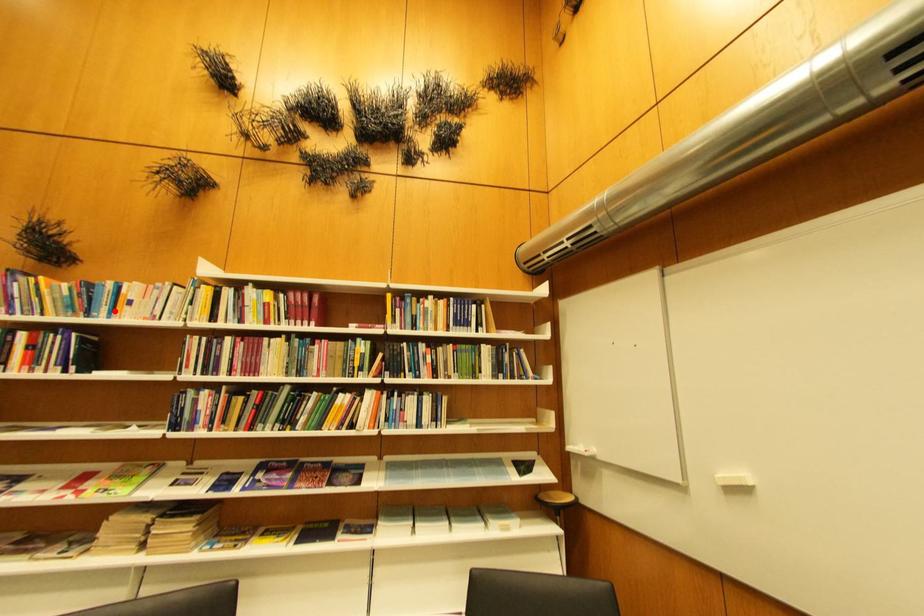
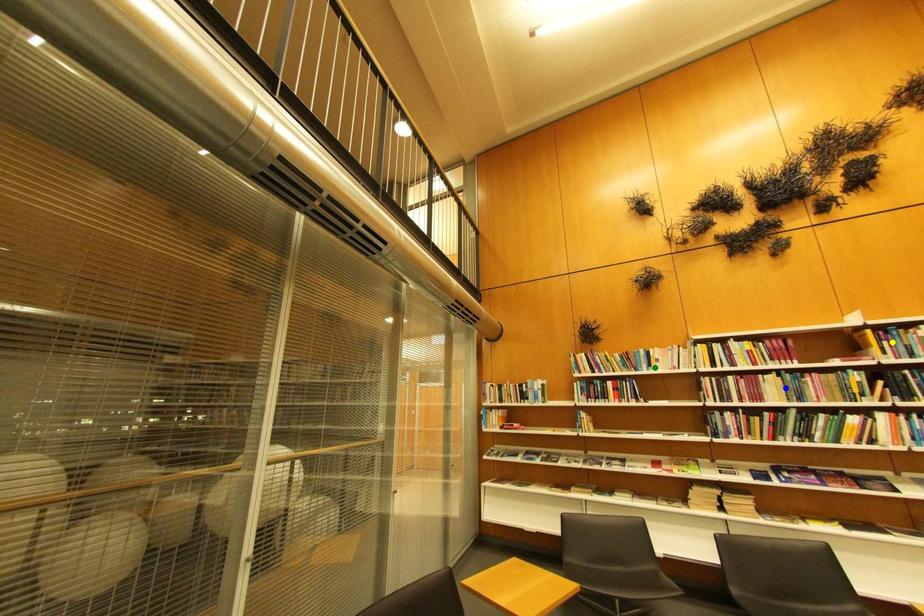
Question: I am providing you with two images of the same scene from different viewpoints. A red point is marked on the first image. You are given multiple points on the second image. Can you choose the point in image 2 that corresponds to the point in image 1?

Choices:
 (A) yellow point
 (B) green point
 (C) blue point

Answer: (B)